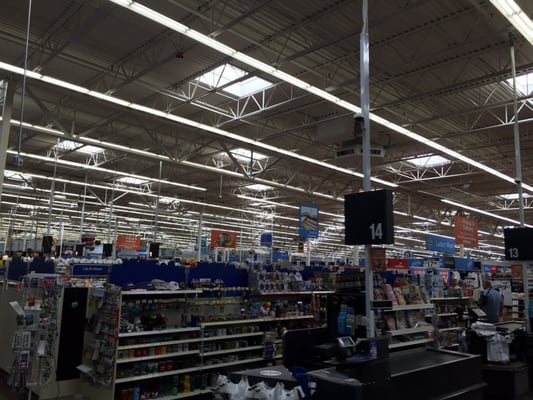
This screenshot has width=533, height=400. Identify the location of register screen. (379, 308).